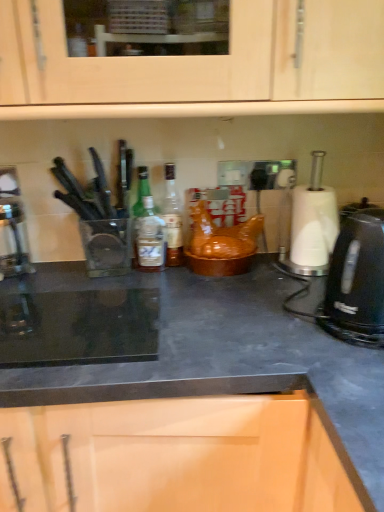
Question: Is black matte countertop at center further to camera compared to black plastic kettle at right?

Choices:
 (A) no
 (B) yes

Answer: (A)

Question: Is black matte countertop at center bigger than black plastic kettle at right?

Choices:
 (A) no
 (B) yes

Answer: (B)

Question: Does black matte countertop at center appear on the left side of black plastic kettle at right?

Choices:
 (A) no
 (B) yes

Answer: (B)

Question: Does black matte countertop at center have a lesser width compared to black plastic kettle at right?

Choices:
 (A) yes
 (B) no

Answer: (B)

Question: Would you say black matte countertop at center is outside black plastic kettle at right?

Choices:
 (A) yes
 (B) no

Answer: (A)

Question: Is black matte countertop at center not near black plastic kettle at right?

Choices:
 (A) no
 (B) yes

Answer: (A)

Question: Is black matte countertop at center next to green glass bottle at center?

Choices:
 (A) no
 (B) yes

Answer: (A)

Question: Is black matte countertop at center oriented away from green glass bottle at center?

Choices:
 (A) yes
 (B) no

Answer: (B)

Question: Is black matte countertop at center completely or partially outside of green glass bottle at center?

Choices:
 (A) yes
 (B) no

Answer: (A)

Question: Is black matte countertop at center smaller than green glass bottle at center?

Choices:
 (A) no
 (B) yes

Answer: (A)

Question: Can you confirm if black matte countertop at center is taller than green glass bottle at center?

Choices:
 (A) no
 (B) yes

Answer: (B)

Question: Is black matte countertop at center wider than green glass bottle at center?

Choices:
 (A) yes
 (B) no

Answer: (A)

Question: Is translucent glass bottle at center looking in the opposite direction of black matte countertop at center?

Choices:
 (A) no
 (B) yes

Answer: (A)